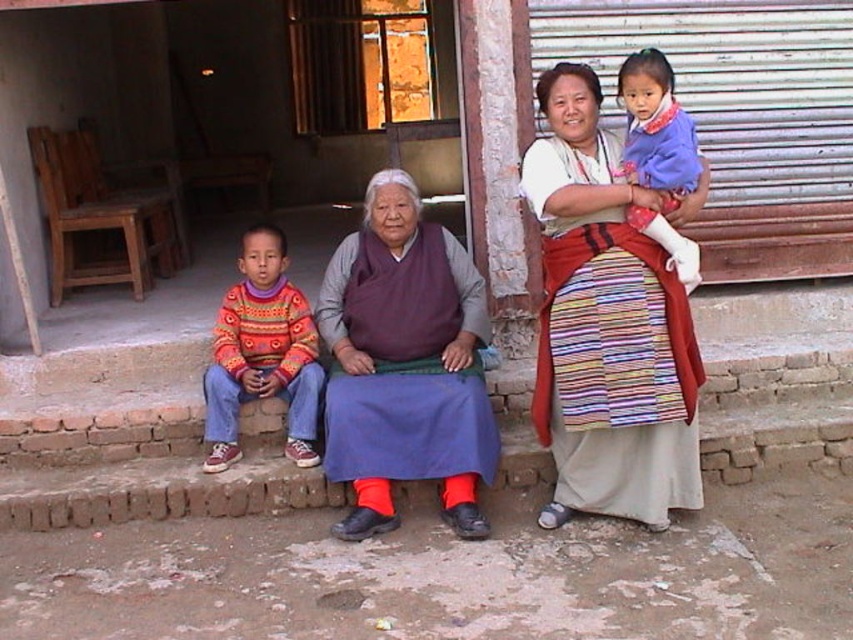
Is multicolored woven cloth at center closer to the viewer compared to purple woolen robe at center?

That is False.

Locate an element on the screen. multicolored woven cloth at center is located at coordinates (613, 314).

Is knitted wool sweater at left above blue fabric baby at center?

No.

Between point (222, 362) and point (675, 244), which one is positioned in front?

Point (675, 244) is in front.

This screenshot has width=853, height=640. I want to click on knitted wool sweater at left, so click(x=262, y=353).

Can you confirm if multicolored woven cloth at center is taller than knitted wool sweater at left?

Indeed, multicolored woven cloth at center has a greater height compared to knitted wool sweater at left.

Which is behind, point (556, 500) or point (282, 346)?

The point (282, 346) is more distant.

Between point (635, 483) and point (253, 285), which one is positioned behind?

Positioned behind is point (253, 285).

Locate an element on the screen. This screenshot has height=640, width=853. multicolored woven cloth at center is located at coordinates (613, 314).